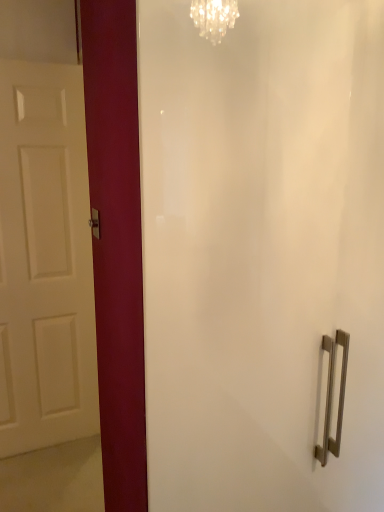
What is the approximate width of satin nickel door handle at center-left?

satin nickel door handle at center-left is 0.57 inches wide.

You are a GUI agent. You are given a task and a screenshot of the screen. Output one action in this format:
    pyautogui.click(x=<x>, y=<y>)
    Task: Click on the satin nickel door handle at center-left
    The height and width of the screenshot is (512, 384).
    Given the screenshot: What is the action you would take?
    pyautogui.click(x=95, y=223)

What do you see at coordinates (95, 223) in the screenshot?
I see `satin nickel door handle at center-left` at bounding box center [95, 223].

What is the approximate height of white matte door at left?

white matte door at left is 7.52 feet tall.

The width and height of the screenshot is (384, 512). What do you see at coordinates (45, 260) in the screenshot? I see `white matte door at left` at bounding box center [45, 260].

Locate an element on the screen. white matte door at left is located at coordinates (45, 260).

Where is `satin nickel door handle at center-left`? satin nickel door handle at center-left is located at coordinates (95, 223).

Does satin nickel door handle at center-left appear on the right side of white matte door at left?

Yes.

In the image, is satin nickel door handle at center-left positioned in front of or behind white matte door at left?

satin nickel door handle at center-left is in front of white matte door at left.

Which point is more distant from viewer, (94, 224) or (33, 245)?

The point (33, 245) is behind.

From the image's perspective, is satin nickel door handle at center-left below white matte door at left?

Indeed, from the image's perspective, satin nickel door handle at center-left is shown beneath white matte door at left.

From a real-world perspective, who is located lower, satin nickel door handle at center-left or white matte door at left?

From a 3D spatial view, white matte door at left is below.

Between satin nickel door handle at center-left and white matte door at left, which one has smaller width?

With smaller width is satin nickel door handle at center-left.

Which of these two, satin nickel door handle at center-left or white matte door at left, stands taller?

Standing taller between the two is white matte door at left.

Does satin nickel door handle at center-left have a smaller size compared to white matte door at left?

Indeed, satin nickel door handle at center-left has a smaller size compared to white matte door at left.

Would you say satin nickel door handle at center-left is inside or outside white matte door at left?

satin nickel door handle at center-left is spatially situated outside white matte door at left.

Is there a large distance between satin nickel door handle at center-left and white matte door at left?

satin nickel door handle at center-left is near white matte door at left, not far away.

Is satin nickel door handle at center-left turned away from white matte door at left?

No, satin nickel door handle at center-left is not facing away from white matte door at left.

What's the angular difference between satin nickel door handle at center-left and white matte door at left's facing directions?

There is a 89-degree angle between the facing directions of satin nickel door handle at center-left and white matte door at left.

Where is `door lying behind the satin nickel door handle at center-left`? This screenshot has height=512, width=384. door lying behind the satin nickel door handle at center-left is located at coordinates tap(45, 260).

Considering the relative positions of white matte door at left and satin nickel door handle at center-left in the image provided, is white matte door at left to the left of satin nickel door handle at center-left from the viewer's perspective?

Yes, white matte door at left is to the left of satin nickel door handle at center-left.

From the picture: Is white matte door at left closer to camera compared to satin nickel door handle at center-left?

No.

Which is further, (2,190) or (98,212)?

The point (2,190) is behind.

From the image's perspective, between white matte door at left and satin nickel door handle at center-left, who is located below?

satin nickel door handle at center-left appears lower in the image.

From a real-world perspective, is white matte door at left located higher than satin nickel door handle at center-left?

Actually, white matte door at left is physically below satin nickel door handle at center-left in the real world.

Between white matte door at left and satin nickel door handle at center-left, which one has smaller width?

satin nickel door handle at center-left is thinner.

Who is shorter, white matte door at left or satin nickel door handle at center-left?

satin nickel door handle at center-left is shorter.

Which of these two, white matte door at left or satin nickel door handle at center-left, is smaller?

satin nickel door handle at center-left is smaller.

Is white matte door at left positioned beyond the bounds of satin nickel door handle at center-left?

Indeed, white matte door at left is completely outside satin nickel door handle at center-left.

Is white matte door at left far away from satin nickel door handle at center-left?

No, white matte door at left is in close proximity to satin nickel door handle at center-left.

Is white matte door at left looking in the opposite direction of satin nickel door handle at center-left?

white matte door at left does not have its back to satin nickel door handle at center-left.

How different are the orientations of white matte door at left and satin nickel door handle at center-left in degrees?

The angular difference between white matte door at left and satin nickel door handle at center-left is 89 degrees.

Locate an element on the screen. door behind the satin nickel door handle at center-left is located at coordinates (45, 260).

Identify the location of door handle in front of the white matte door at left. (95, 223).

Locate an element on the screen. The height and width of the screenshot is (512, 384). door handle above the white matte door at left (from a real-world perspective) is located at coordinates (95, 223).